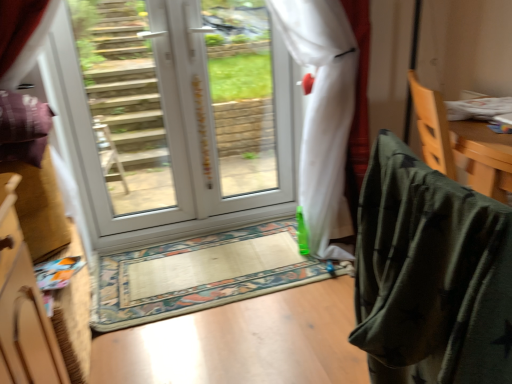
Locate an element on the screen. The image size is (512, 384). camouflage fabric bag at right is located at coordinates (462, 144).

In order to face beige fabric doormat at center, should I rotate leftwards or rightwards?

Turn left by 5.934 degrees to look at beige fabric doormat at center.

The image size is (512, 384). What are the coordinates of `camouflage fabric bag at right` in the screenshot? It's located at point(462,144).

Between dark green fabric at right and white glossy door at center, which one appears on the left side from the viewer's perspective?

white glossy door at center.

From the image's perspective, which object appears higher, dark green fabric at right or white glossy door at center?

white glossy door at center is shown above in the image.

From the picture: From a real-world perspective, does dark green fabric at right stand above white glossy door at center?

Actually, dark green fabric at right is physically below white glossy door at center in the real world.

From the picture: Does dark green fabric at right have a lesser height compared to white glossy door at center?

Correct, dark green fabric at right is not as tall as white glossy door at center.

Looking at this image, is white glossy glass door at upper center far away from white glossy door at center?

They are positioned close to each other.

Is white glossy door at center completely or partially inside white glossy glass door at upper center?

Yes, white glossy door at center can be found within white glossy glass door at upper center.

Where is `door above the white glossy glass door at upper center (from the image's perspective)`? Image resolution: width=512 pixels, height=384 pixels. door above the white glossy glass door at upper center (from the image's perspective) is located at coordinates (176, 118).

Does white glossy glass door at upper center have a greater width compared to white glossy door at center?

Correct, the width of white glossy glass door at upper center exceeds that of white glossy door at center.

Between point (222, 57) and point (477, 147), which one is positioned behind?

Point (222, 57)

Which object is thinner, white glossy door at center or camouflage fabric bag at right?

white glossy door at center is thinner.

Is white glossy door at center taller or shorter than camouflage fabric bag at right?

white glossy door at center is taller than camouflage fabric bag at right.

From the picture: Would you say white glossy door at center is a long distance from camouflage fabric bag at right?

Yes, white glossy door at center is far from camouflage fabric bag at right.

Is there a large distance between transparent plastic window screen at center and white glossy glass door at upper center?

Yes, transparent plastic window screen at center is far from white glossy glass door at upper center.

Is point (207, 20) farther from camera compared to point (108, 197)?

That is True.

Is the position of transparent plastic window screen at center less distant than that of white glossy glass door at upper center?

No, it is behind white glossy glass door at upper center.

From the picture: Is dark green fabric at right positioned beyond the bounds of white glossy glass door at upper center?

dark green fabric at right is positioned outside white glossy glass door at upper center.

In terms of width, does dark green fabric at right look wider or thinner when compared to white glossy glass door at upper center?

Considering their sizes, dark green fabric at right looks broader than white glossy glass door at upper center.

Locate an element on the screen. This screenshot has width=512, height=384. blanket in front of the white glossy glass door at upper center is located at coordinates (431, 275).

Would you say dark green fabric at right is a long distance from white glossy glass door at upper center?

Absolutely, dark green fabric at right is distant from white glossy glass door at upper center.

Does white glossy door at center have a lesser width compared to white glossy glass door at upper center?

Yes.

Find the location of `glass door that is above the white glossy door at center (from a real-world perspective)`. glass door that is above the white glossy door at center (from a real-world perspective) is located at coordinates (129, 120).

Which is behind, white glossy door at center or white glossy glass door at upper center?

white glossy door at center is more distant.

How distant is white glossy door at center from white glossy glass door at upper center?

4.75 inches.

Considering the points (101, 69) and (339, 267), which point is in front, point (101, 69) or point (339, 267)?

The point (339, 267) is closer to the camera.

Considering the positions of objects white glossy glass door at upper center and beige fabric doormat at center in the image provided, who is more to the left, white glossy glass door at upper center or beige fabric doormat at center?

white glossy glass door at upper center.

From a real-world perspective, is white glossy glass door at upper center on top of beige fabric doormat at center?

Correct, in the physical world, white glossy glass door at upper center is higher than beige fabric doormat at center.

From the image's perspective, is white glossy glass door at upper center beneath beige fabric doormat at center?

No, from the image's perspective, white glossy glass door at upper center is not below beige fabric doormat at center.

In the image, there is a dark green fabric at right. Find the location of `door above it (from the image's perspective)`. door above it (from the image's perspective) is located at coordinates (176, 118).

Image resolution: width=512 pixels, height=384 pixels. I want to click on glass door on the left side of white glossy door at center, so click(129, 120).

Estimate the real-world distances between objects in this image. Which object is closer to white glossy door at center, dark green fabric at right or camouflage fabric bag at right?

Based on the image, camouflage fabric bag at right appears to be nearer to white glossy door at center.

Estimate the real-world distances between objects in this image. Which object is further from camouflage fabric bag at right, transparent plastic window screen at center or dark green fabric at right?

Based on the image, transparent plastic window screen at center appears to be further to camouflage fabric bag at right.

Which object lies nearer to the anchor point wooden cabinet at left, transparent plastic window screen at center or camouflage fabric bag at right?

Based on the image, camouflage fabric bag at right appears to be nearer to wooden cabinet at left.

Consider the image. Considering their positions, is wooden cabinet at left positioned closer to white glossy glass door at upper center than dark green fabric at right?

wooden cabinet at left.

When comparing their distances from transparent plastic window screen at center, does dark green fabric at right or beige fabric doormat at center seem further?

dark green fabric at right is positioned further to the anchor transparent plastic window screen at center.

Looking at the image, which one is located closer to white glossy door at center, wooden cabinet at left or beige fabric doormat at center?

beige fabric doormat at center is positioned closer to the anchor white glossy door at center.

Considering their positions, is dark green fabric at right positioned closer to camouflage fabric bag at right than transparent plastic window screen at center?

dark green fabric at right.

From the image, which object appears to be nearer to white glossy door at center, wooden cabinet at left or dark green fabric at right?

wooden cabinet at left lies closer to white glossy door at center than the other object.

The image size is (512, 384). I want to click on glass door between transparent plastic window screen at center and wooden cabinet at left in the up-down direction, so click(129, 120).

The height and width of the screenshot is (384, 512). Find the location of `glass door that lies between transparent plastic window screen at center and beige fabric doormat at center from top to bottom`. glass door that lies between transparent plastic window screen at center and beige fabric doormat at center from top to bottom is located at coordinates (129, 120).

At what (x,y) coordinates should I click in order to perform the action: click on door between wooden cabinet at left and camouflage fabric bag at right from left to right. Please return your answer as a coordinate pair (x, y). Looking at the image, I should click on (176, 118).

This screenshot has height=384, width=512. I want to click on doormat between white glossy door at center and camouflage fabric bag at right in the horizontal direction, so click(x=199, y=274).